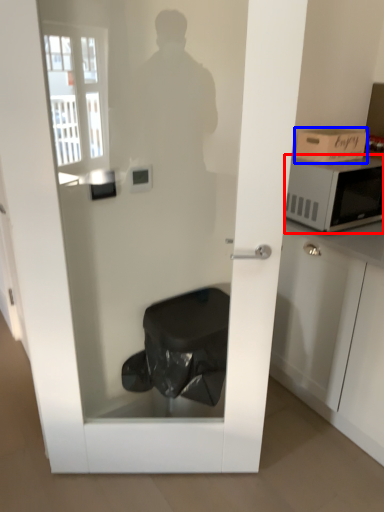
Question: Which object is closer to the camera taking this photo, microwave oven (highlighted by a red box) or cardboard box (highlighted by a blue box)?

Choices:
 (A) microwave oven
 (B) cardboard box

Answer: (A)